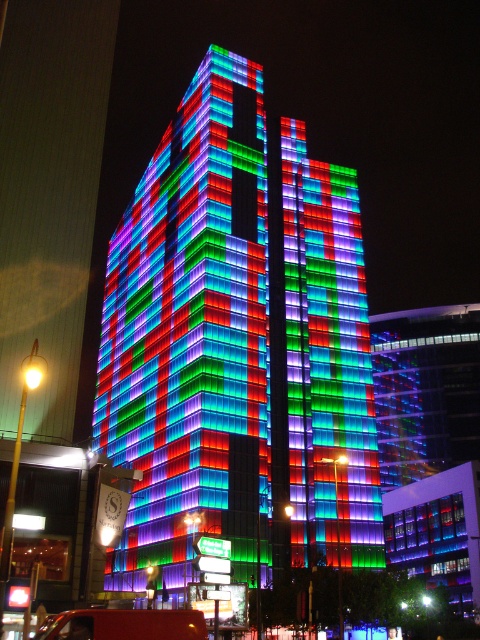
Is multicolored glass building at center taller than metallic red truck at lower left?

Yes, multicolored glass building at center is taller than metallic red truck at lower left.

Does multicolored glass building at center lie behind metallic red truck at lower left?

Yes, multicolored glass building at center is further from the viewer.

Does point (254, 115) lie in front of point (113, 627)?

No.

At what (x,y) coordinates should I click in order to perform the action: click on multicolored glass building at center. Please return your answer as a coordinate pair (x, y). This screenshot has height=640, width=480. Looking at the image, I should click on (239, 344).